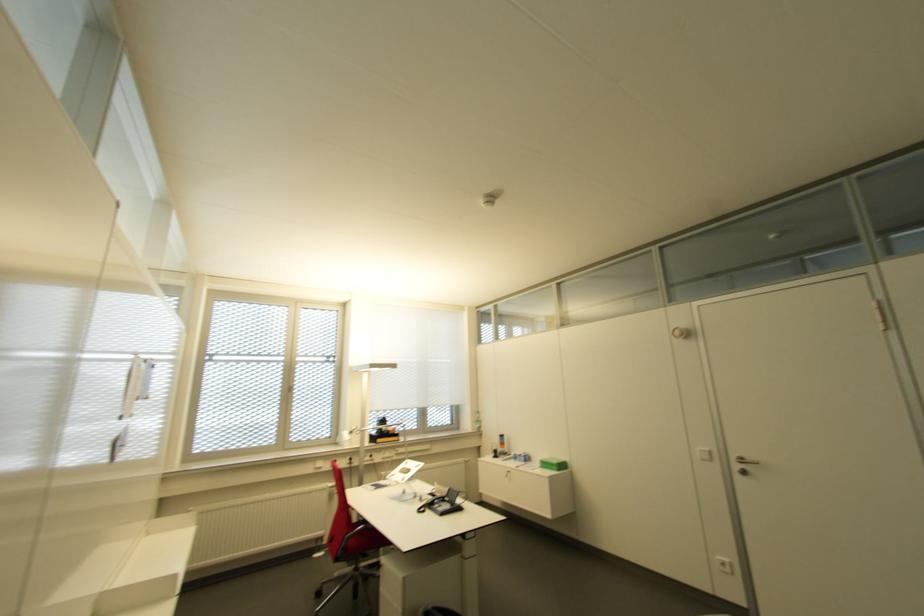
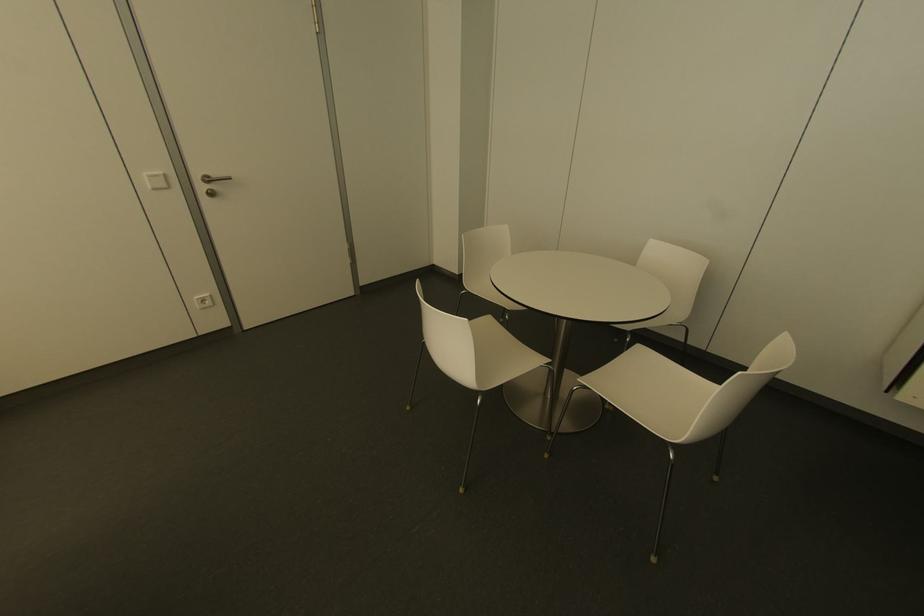
Where in the second image is the point corresponding to pixel 706 451 from the first image?

(159, 172)